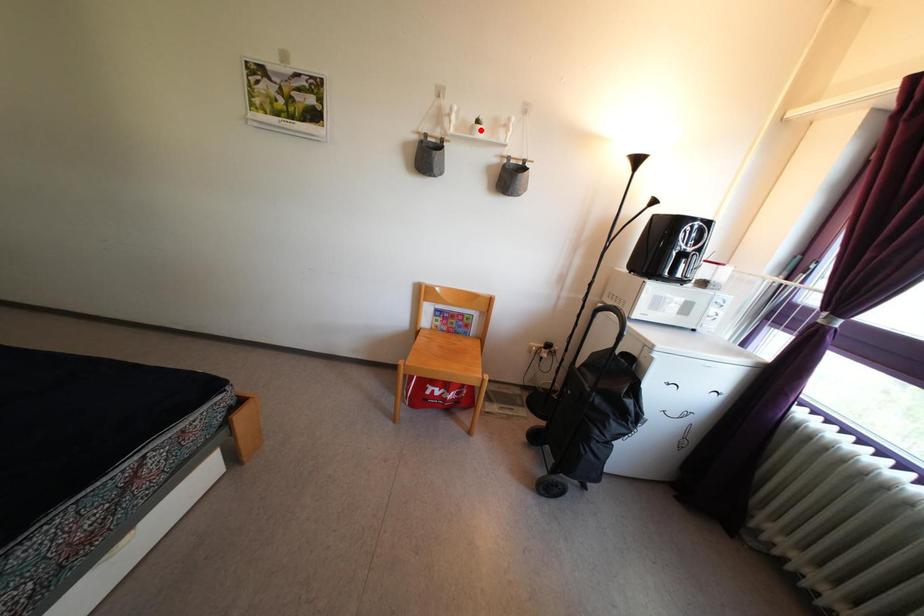
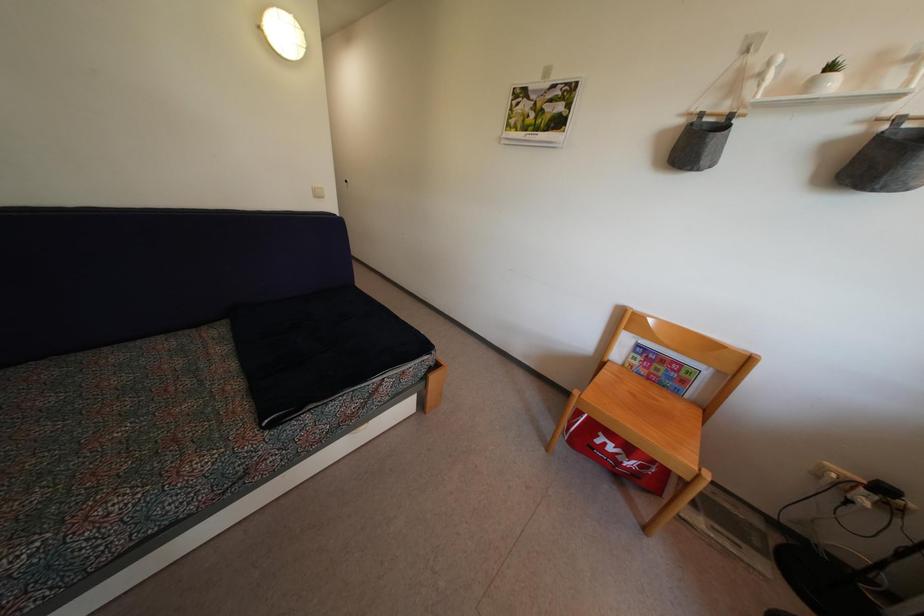
Question: I am providing you with two images of the same scene from different viewpoints. In image1, a red point is highlighted. Considering the same 3D point in image2, which of the following is correct?

Choices:
 (A) It is closer
 (B) It is farther

Answer: (B)